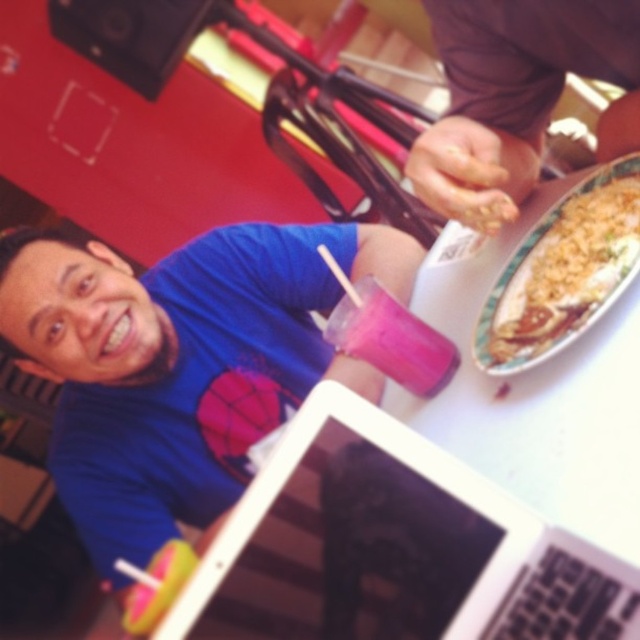
You are a server at the restaurant. You see the brown matte hand at upper center and the yellowish rice at right. Which object is closer to the ceiling?

The brown matte hand at upper center is much taller than the yellowish rice at right, so it is closer to the ceiling.

You are a customer at this restaurant and want to place your phone on the table without it overlapping any objects. The phone is the same size as the brown matte hand at upper center. Is there enough space between the white glossy laptop at center and the edge of the table to place your phone?

The white glossy laptop at center is wider than the brown matte hand at upper center. Since the phone is the same size as the hand, there should be sufficient space between the laptop and the table edge to place the phone without overlapping.

You are a photographer taking a picture of the scene. You notice the white glossy laptop at center and the brown matte hand at upper center. Which object is closer to the camera?

The white glossy laptop at center is closer to the camera than the brown matte hand at upper center because it is positioned in front of it.